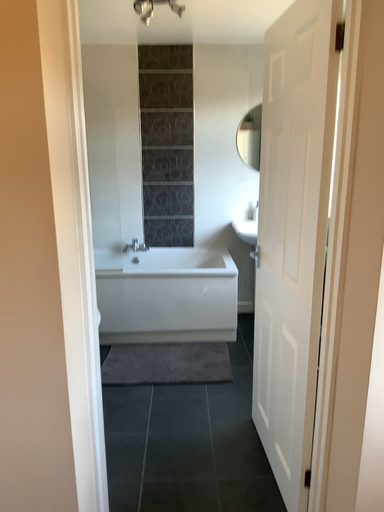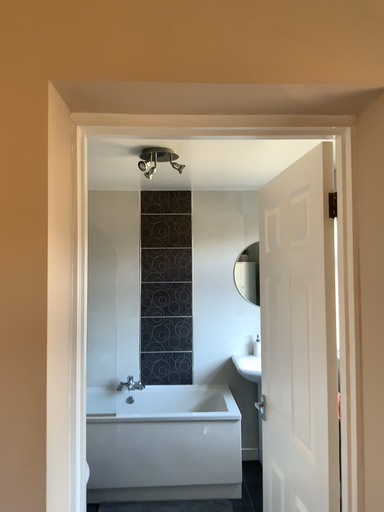
Question: How did the camera likely rotate when shooting the video?

Choices:
 (A) rotated downward
 (B) rotated upward

Answer: (B)